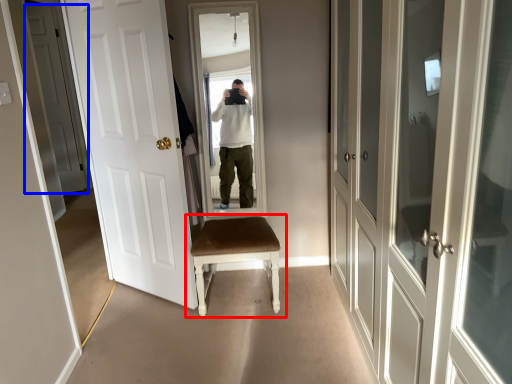
Question: Among these objects, which one is farthest to the camera, chair (highlighted by a red box) or door (highlighted by a blue box)?

Choices:
 (A) chair
 (B) door

Answer: (B)